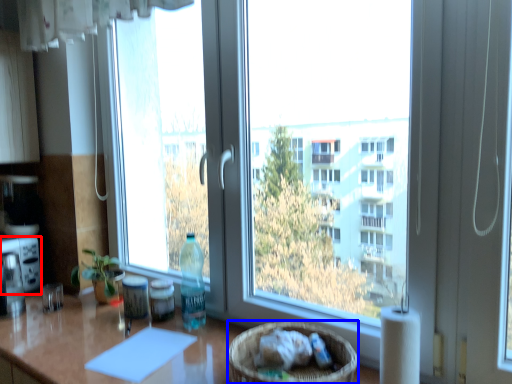
Question: Which object appears closest to the camera in this image, appliance (highlighted by a red box) or basket (highlighted by a blue box)?

Choices:
 (A) appliance
 (B) basket

Answer: (B)